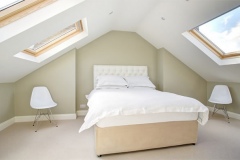
At what (x,y) coordinates should I click in order to perform the action: click on bed frame. Please return your answer as a coordinate pair (x, y). Looking at the image, I should click on (139, 144).